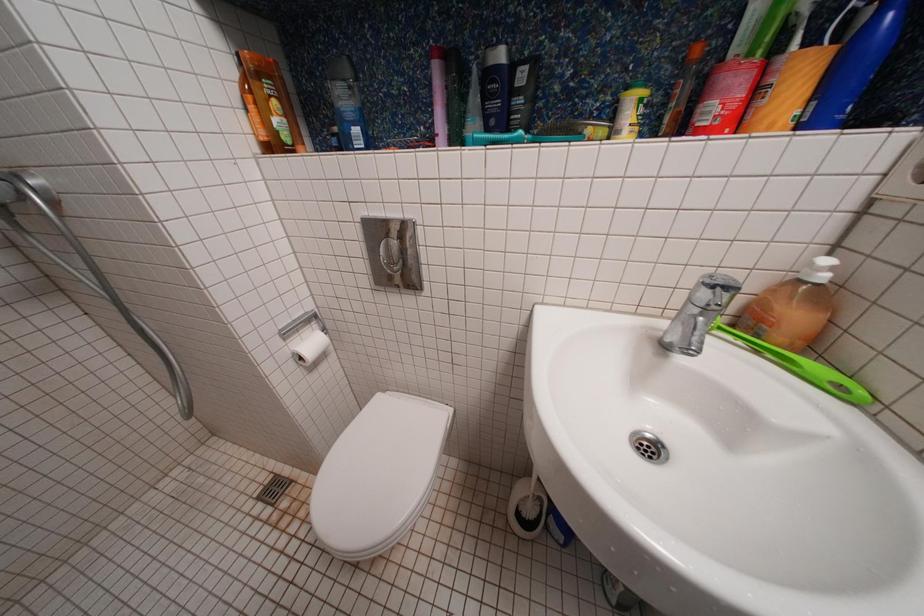
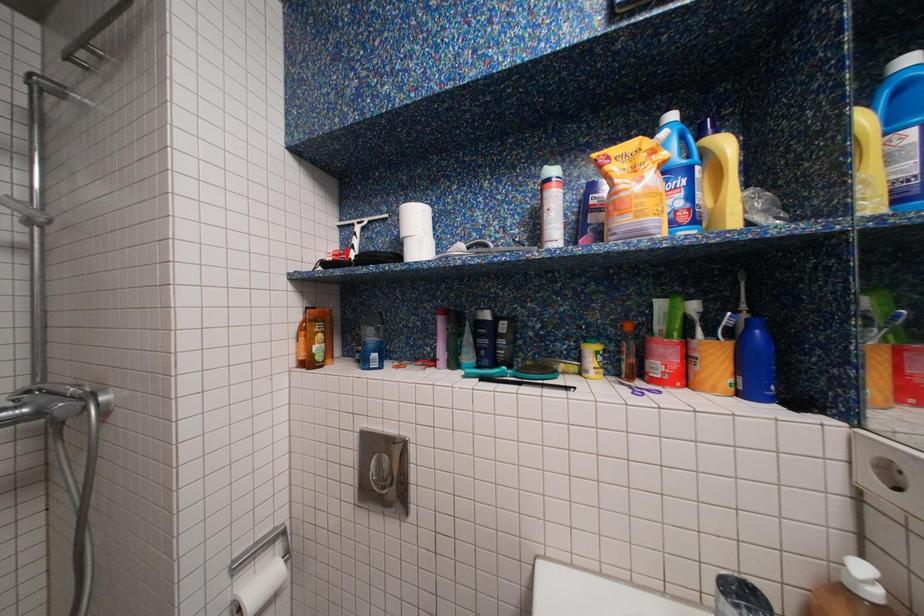
Question: The first image is from the beginning of the video and the second image is from the end. How did the camera likely rotate when shooting the video?

Choices:
 (A) Left
 (B) Right
 (C) Up
 (D) Down

Answer: (C)